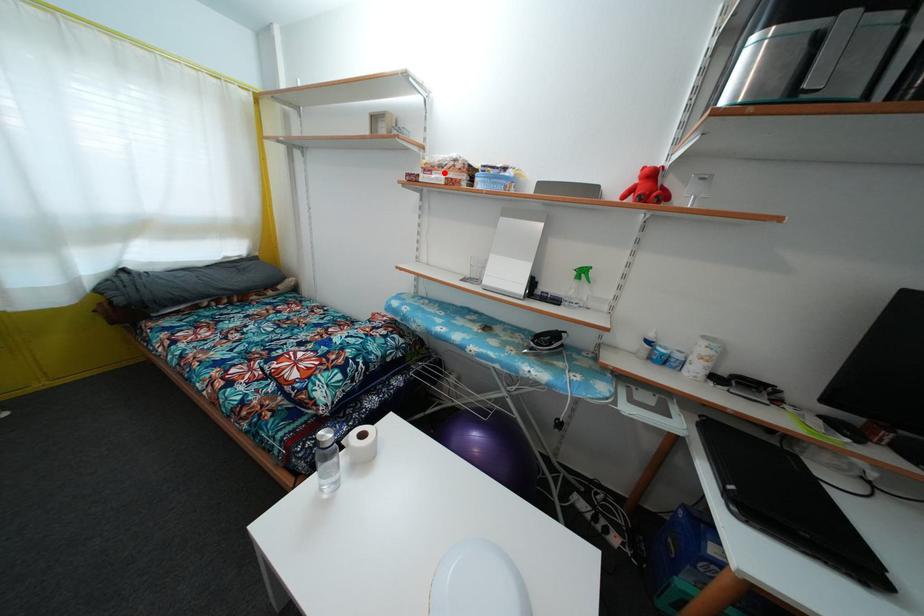
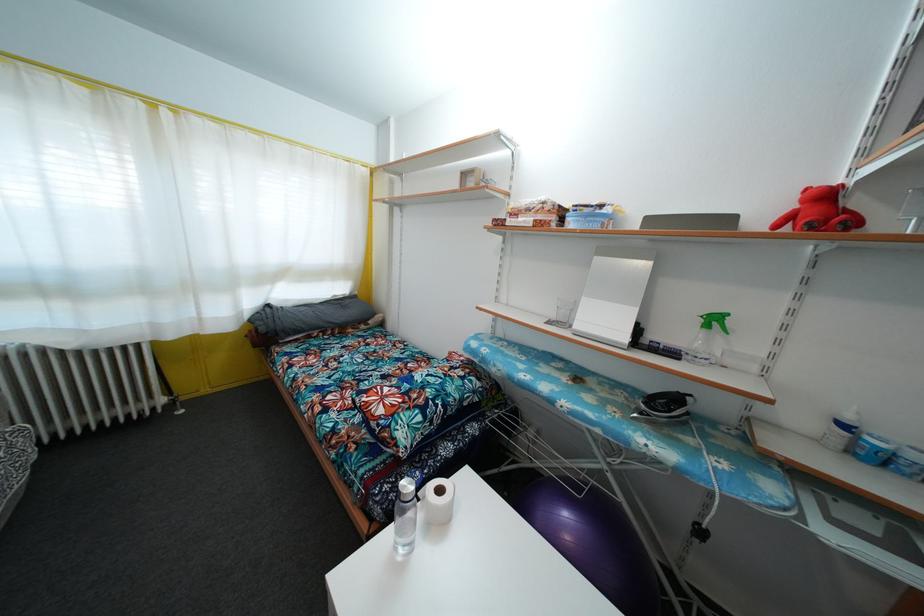
Question: I am providing you with two images of the same scene from different viewpoints. A red point is marked on the first image. Is the red point's position out of view in image 2?

Choices:
 (A) Yes
 (B) No

Answer: (B)